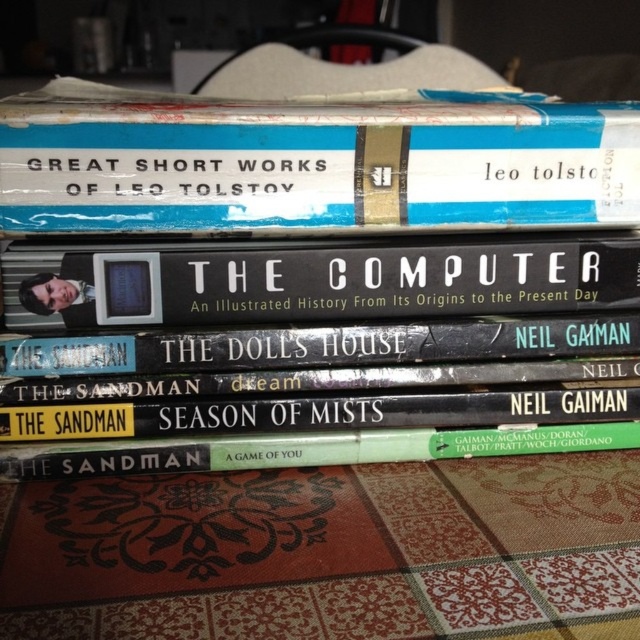
You are standing in front of a bookshelf and see the hardcover book at center and the green matte book at center. Which book is positioned closer to you?

The hardcover book at center is closer to the viewer than the green matte book at center.